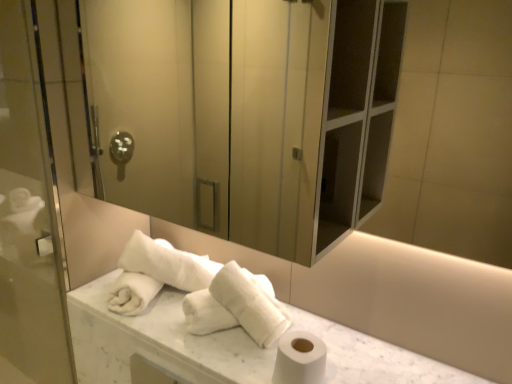
You are a GUI agent. You are given a task and a screenshot of the screen. Output one action in this format:
    pyautogui.click(x=<x>, y=<y>)
    Task: Click on the free space in front of white fluffy towels at center, which appears as the first bath towel when viewed from the right
    
    Given the screenshot: What is the action you would take?
    pyautogui.click(x=229, y=359)